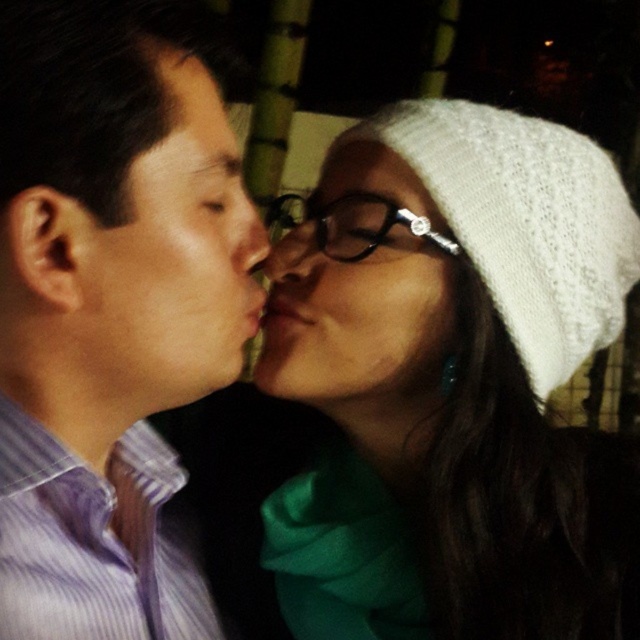
You are a photographer standing 24 inches away from the couple in the image. You want to capture a close shot of the white knitted hat at upper right. Is the current distance sufficient to focus on the hat?

The white knitted hat at upper right is 23.73 inches away from the viewer. Since the photographer is standing 24 inches away, the distance is sufficient to focus on the hat as it is just slightly farther than the photographer.

You are a photographer adjusting the focus on your camera. You want to ensure both the white knitted hat at upper right and the matte black nose at center are in sharp focus. Given that your camera can focus on objects within a 15 cm range, will both objects be in focus?

The distance between the white knitted hat at upper right and the matte black nose at center is 20.25 centimeters. Since the camera can only focus within a 15 cm range, the objects are too far apart to both be in sharp focus.

You are an artist trying to draw the scene. You need to determine which of the two points, point (509, 352) or point (266, 280), is closer to the viewer. Which one should you depict as closer?

Point (509, 352) is closer to the viewer than point (266, 280), so you should depict point (509, 352) as closer.